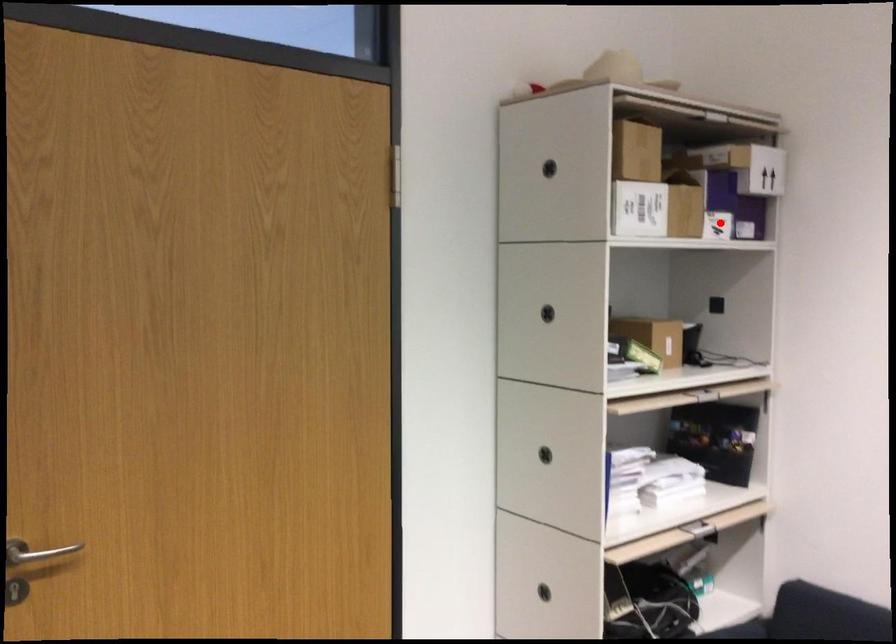
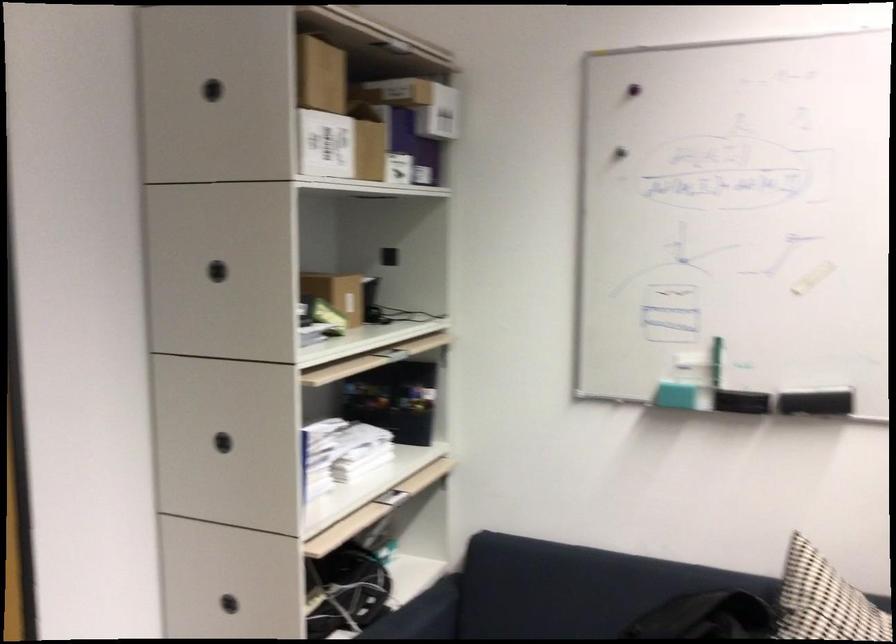
Find the pixel in the second image that matches the highlighted location in the first image.

(398, 167)